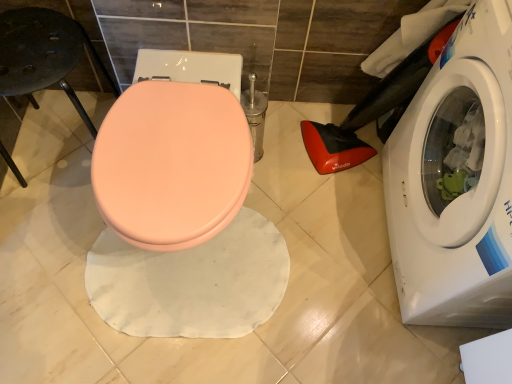
Question: Considering their positions, is black matte bar stool at left located in front of or behind white glossy washing machine at lower right?

Choices:
 (A) behind
 (B) front

Answer: (A)

Question: Is point (37, 77) closer or farther from the camera than point (471, 150)?

Choices:
 (A) closer
 (B) farther

Answer: (A)

Question: Based on their relative distances, which object is nearer to the white glossy washing machine at lower right?

Choices:
 (A) black matte bar stool at left
 (B) matte peach toilet seat at center

Answer: (B)

Question: Based on their relative distances, which object is farther from the white glossy washing machine at lower right?

Choices:
 (A) black matte bar stool at left
 (B) matte peach toilet seat at center

Answer: (A)